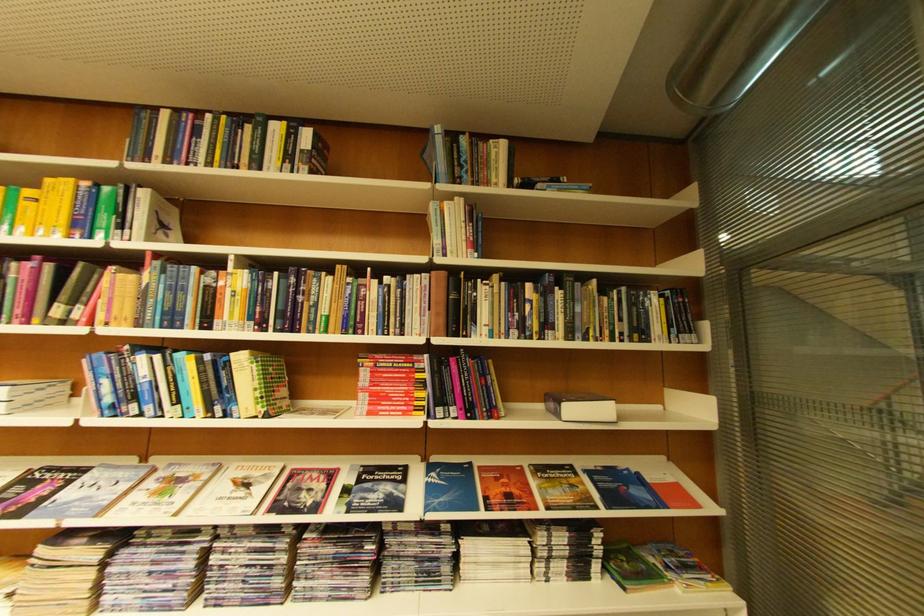
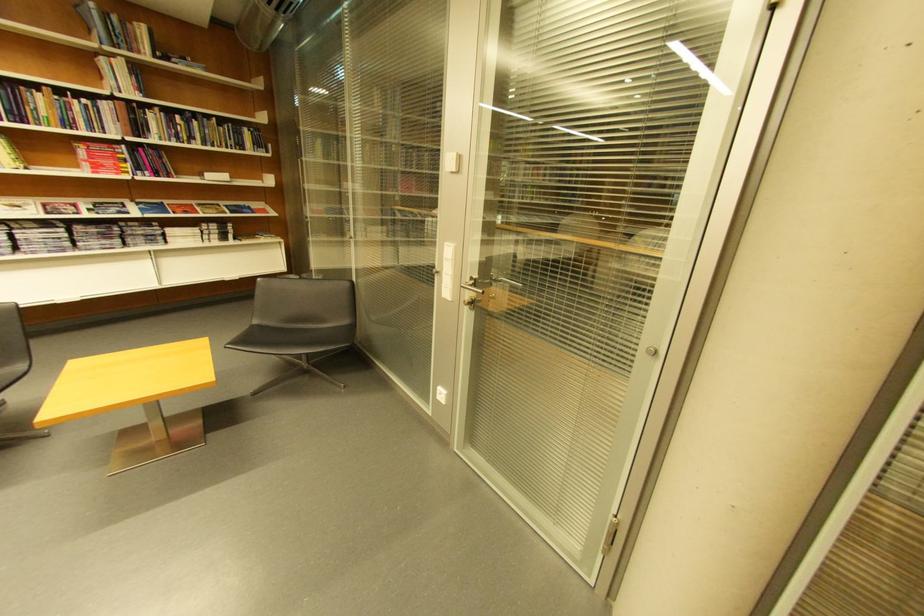
In the second image, find the point that corresponds to (x=334, y=313) in the first image.

(54, 116)